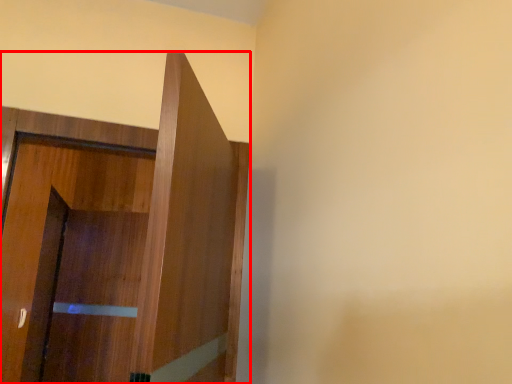
Question: Observing the image, what is the correct spatial positioning of door (annotated by the red box) in reference to screen door?

Choices:
 (A) right
 (B) left

Answer: (A)